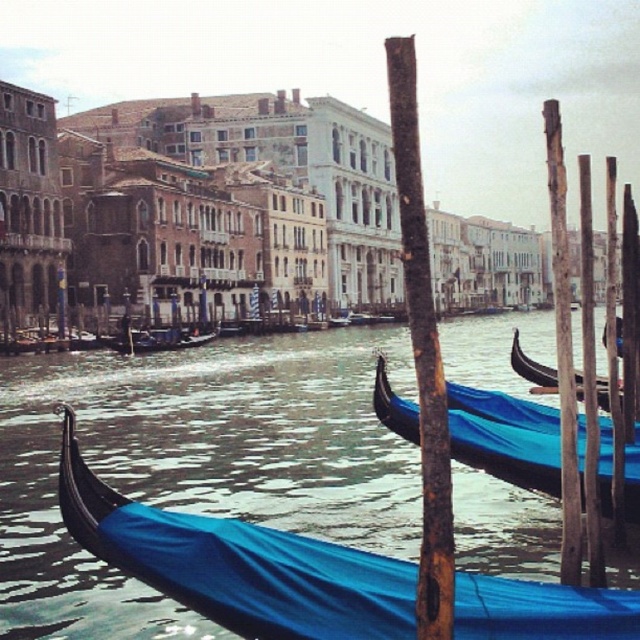
Does blue fabric gondola at center appear over blue fabric boat at center?

No.

Does point (600, 451) lie in front of point (163, 344)?

Yes.

Between point (380, 378) and point (173, 342), which one is positioned behind?

Point (173, 342)

The image size is (640, 640). Identify the location of blue fabric gondola at center. (506, 449).

Does blue polished wood gondola at center have a greater width compared to shiny black gondola at right?

Correct, the width of blue polished wood gondola at center exceeds that of shiny black gondola at right.

Is blue polished wood gondola at center smaller than shiny black gondola at right?

No, blue polished wood gondola at center is not smaller than shiny black gondola at right.

Does point (284, 618) lie in front of point (516, 365)?

Yes.

Locate an element on the screen. blue polished wood gondola at center is located at coordinates (237, 564).

Who is more distant from viewer, (113, 525) or (120, 333)?

Positioned behind is point (120, 333).

Identify the location of blue polished wood gondola at center. The width and height of the screenshot is (640, 640). 237,564.

The height and width of the screenshot is (640, 640). Find the location of `blue polished wood gondola at center`. blue polished wood gondola at center is located at coordinates (237, 564).